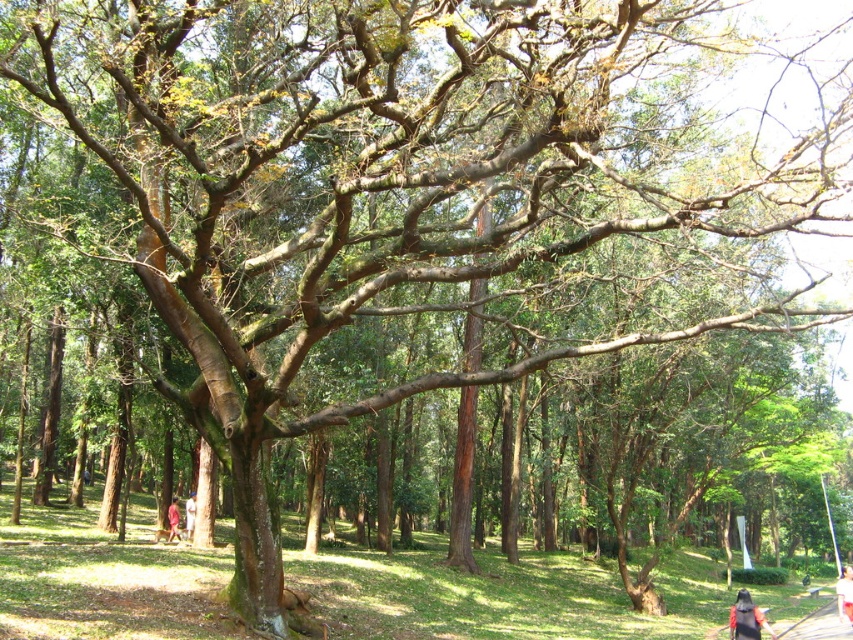
You are standing in the forest scene and notice a white cotton shirt at center and a red fabric person at lower left. Which object is closer to you?

The white cotton shirt at center is closer to you because it is in front of the red fabric person at lower left.

You are packing for a hike and see both the dark blue shirt at lower right and the white cotton shirt at center in your bag. Which shirt should you choose if you want the larger one for better sun protection?

The white cotton shirt at center is larger, so you should choose it for better sun protection.